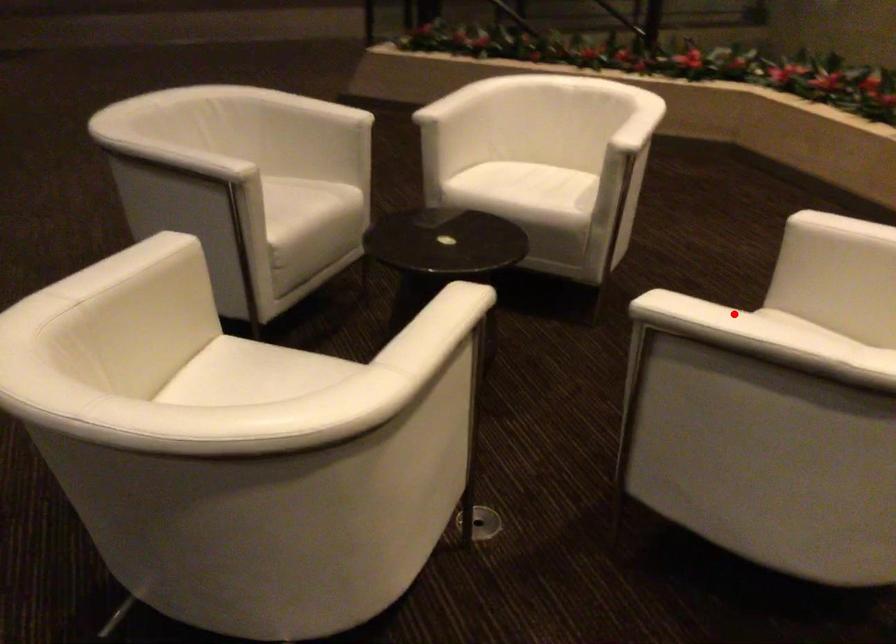
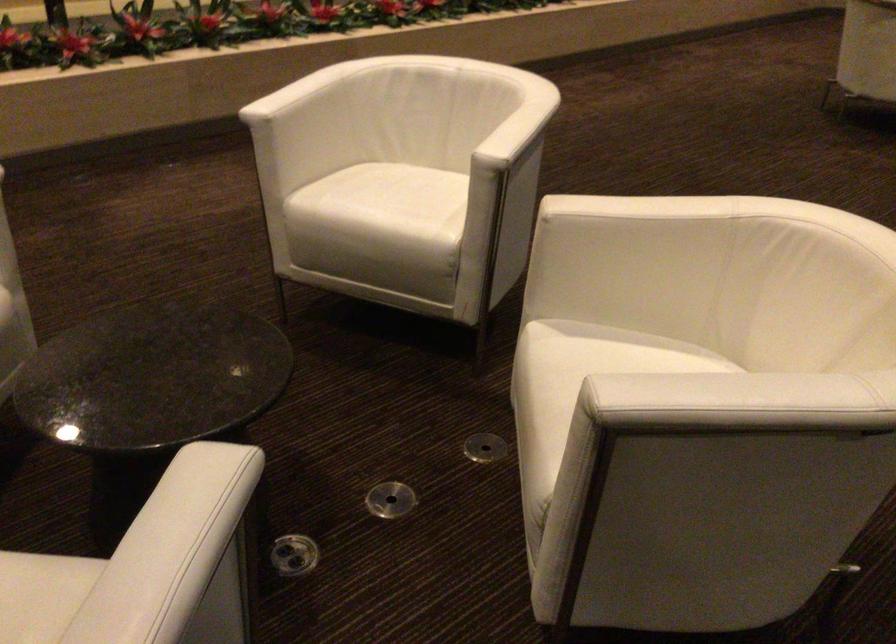
The point at the highlighted location is marked in the first image. Where is the corresponding point in the second image?

(515, 122)